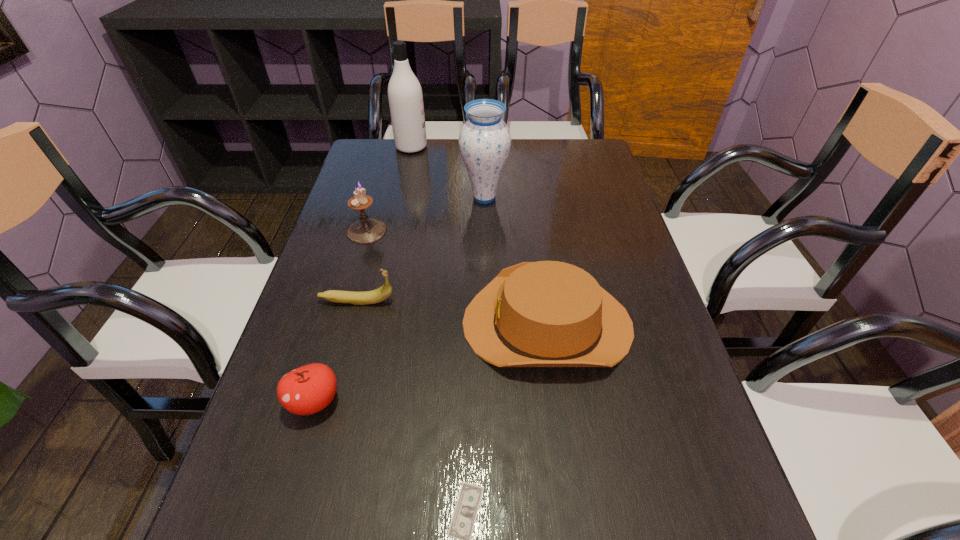
Identify the location of banana that is at the left edge. This screenshot has height=540, width=960. (384, 292).

Identify the location of apple that is positioned at the left edge. (309, 389).

Identify the location of object at the right edge. The height and width of the screenshot is (540, 960). (548, 313).

At what (x,y) coordinates should I click in order to perform the action: click on object at the far left corner. Please return your answer as a coordinate pair (x, y). Looking at the image, I should click on tap(405, 96).

Where is `free spot at the far edge of the desktop`? The image size is (960, 540). free spot at the far edge of the desktop is located at coordinates (536, 173).

Locate an element on the screen. The width and height of the screenshot is (960, 540). free space at the left edge is located at coordinates (388, 198).

Locate an element on the screen. blank space at the right edge is located at coordinates (601, 187).

Where is `vacant space at the far left corner of the desktop`? The image size is (960, 540). vacant space at the far left corner of the desktop is located at coordinates (387, 176).

Identify the location of free space at the far right corner. (576, 154).

Find the location of a particular element. This screenshot has height=540, width=960. free space between the shampoo and the candle holder is located at coordinates (389, 189).